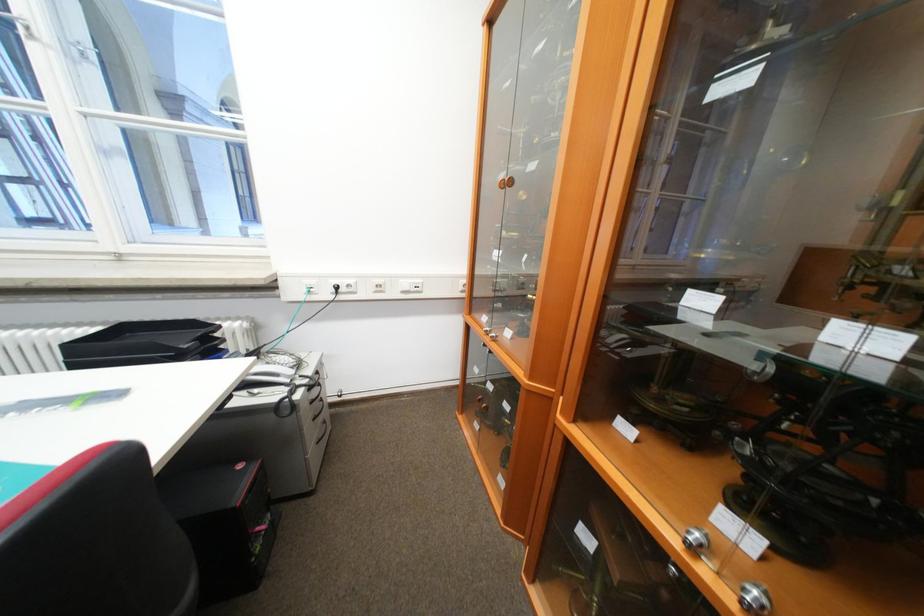
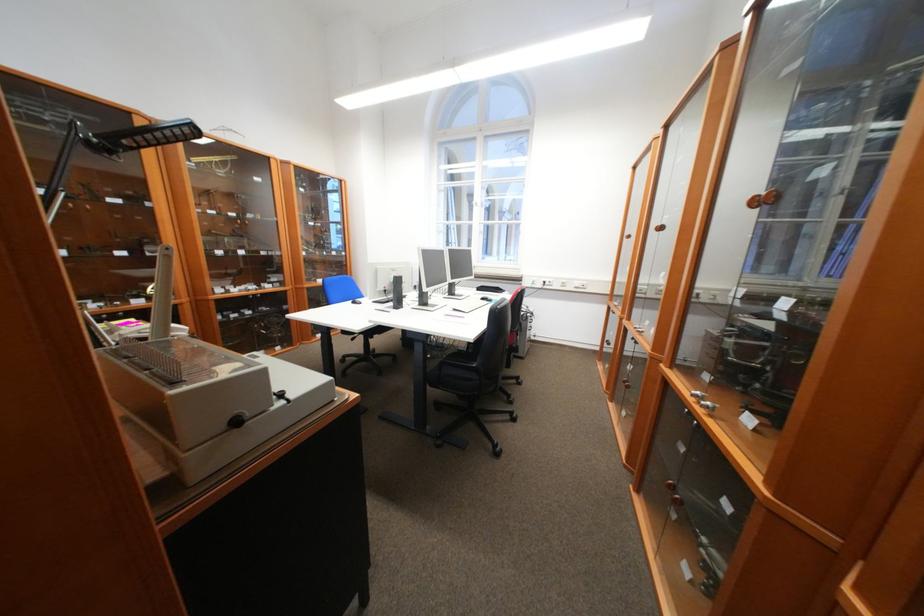
Where in the second image is the point corresponding to pixel 343 291 from the first image?

(553, 284)